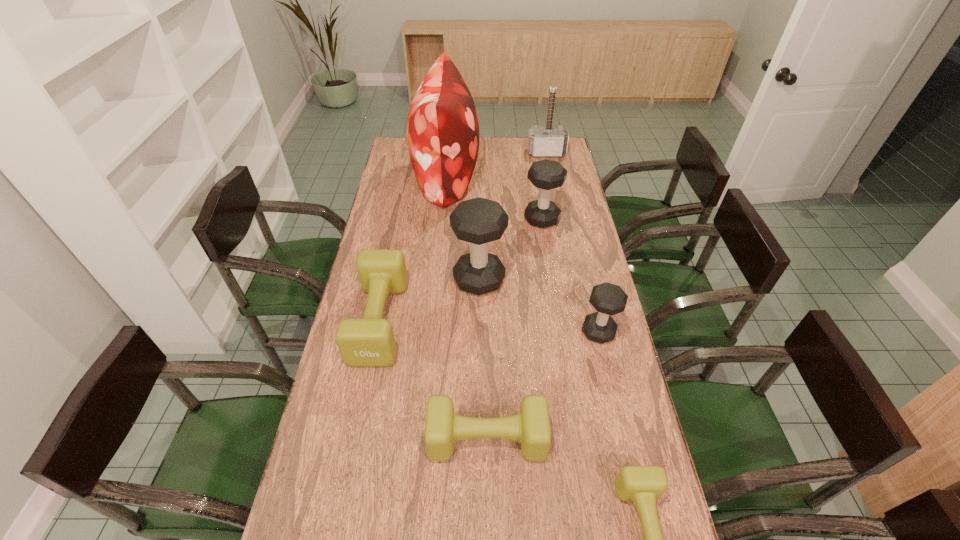
The width and height of the screenshot is (960, 540). What are the coordinates of `hammer that is at the far edge` in the screenshot? It's located at (543, 141).

Locate an element on the screen. The height and width of the screenshot is (540, 960). cushion at the left edge is located at coordinates (442, 129).

What are the coordinates of `dumbbell at the left edge` in the screenshot? It's located at (369, 341).

At what (x,y) coordinates should I click in order to perform the action: click on hammer that is positioned at the right edge. Please return your answer as a coordinate pair (x, y). Image resolution: width=960 pixels, height=540 pixels. Looking at the image, I should click on (543, 141).

You are a GUI agent. You are given a task and a screenshot of the screen. Output one action in this format:
    pyautogui.click(x=<x>, y=<y>)
    Task: Click on the object positioned at the far left corner
    The image size is (960, 540).
    Given the screenshot: What is the action you would take?
    pyautogui.click(x=442, y=129)

You are a GUI agent. You are given a task and a screenshot of the screen. Output one action in this format:
    pyautogui.click(x=<x>, y=<y>)
    Task: Click on the object that is at the far right corner
    
    Given the screenshot: What is the action you would take?
    pyautogui.click(x=543, y=141)

At what (x,y) coordinates should I click in order to perform the action: click on vacant space at the left edge of the desktop. Please return your answer as a coordinate pair (x, y). Image resolution: width=960 pixels, height=540 pixels. Looking at the image, I should click on (413, 213).

Identify the location of blank space at the right edge of the desktop. The image size is (960, 540). (639, 444).

Image resolution: width=960 pixels, height=540 pixels. In the image, there is a desktop. Find the location of `free space at the far right corner`. free space at the far right corner is located at coordinates (553, 158).

Find the location of a particular element. This screenshot has height=540, width=960. free spot between the sixth tallest object and the tallest dumbbell is located at coordinates (429, 300).